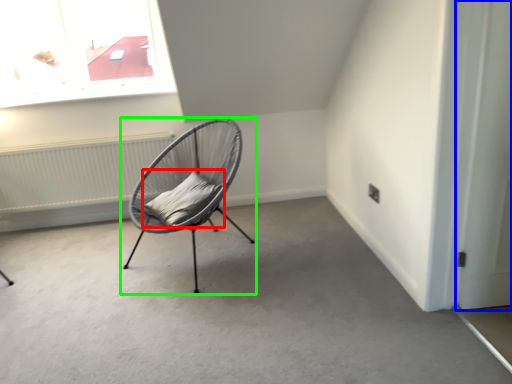
Question: Considering the real-world distances, which object is closest to pillow (highlighted by a red box)? door (highlighted by a blue box) or chair (highlighted by a green box).

Choices:
 (A) door
 (B) chair

Answer: (B)